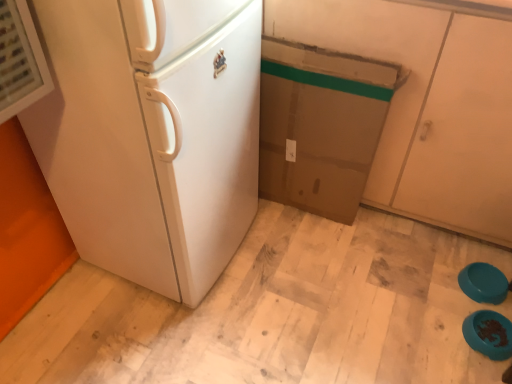
Where is `free area behind teal glossy bowls at lower right, the 2th appliance in the back-to-front sequence`? free area behind teal glossy bowls at lower right, the 2th appliance in the back-to-front sequence is located at coordinates (457, 291).